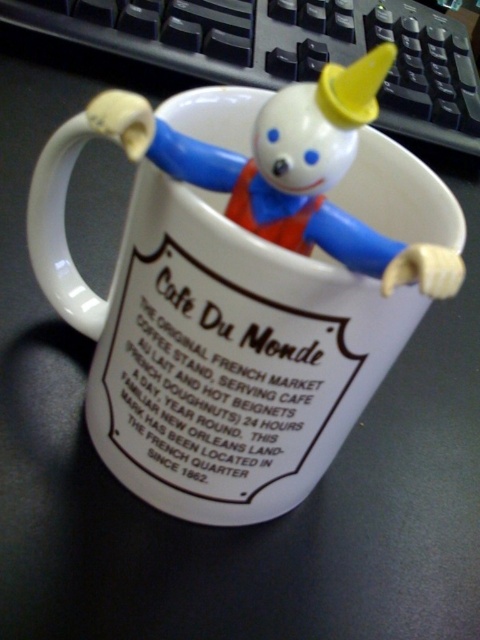
You are a delivery person who needs to place a small package that is 5 inches long into a box. You have a box that can only fit items up to 5 inches in length. Looking at the image, can you determine if the distance between the white ceramic mug at center and the plastic toy at upper center is sufficient to fit the package?

The distance between the white ceramic mug at center and the plastic toy at upper center is 5.05 inches, which is slightly longer than the package length of 5 inches. Therefore, the package should fit in the box.

You are a barista standing at a counter. You need to place a new mug exactly at point 0.5 on both axes. The white ceramic mug at center is currently at point 0.536, 0.444. Can you move the mug to the desired position without needing to adjust its current location?

The white ceramic mug at center is currently at point [213,342], which is not exactly at 0.5 on both axes. Therefore, you need to adjust its position to reach the desired coordinates.

You are a person who wants to place a black plastic keyboard at upper center on the desk without spilling the contents of the ceramic mug. What is the minimum distance you should keep between them?

The minimum distance you should keep between the ceramic mug and the black plastic keyboard at upper center is 1.13 meters to avoid spilling the contents.